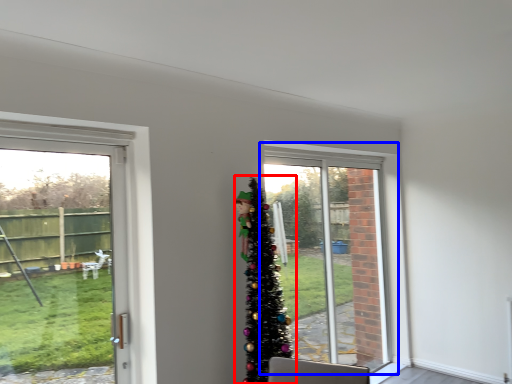
Question: Which of the following is the farthest to the observer, christmas tree (highlighted by a red box) or window (highlighted by a blue box)?

Choices:
 (A) christmas tree
 (B) window

Answer: (B)